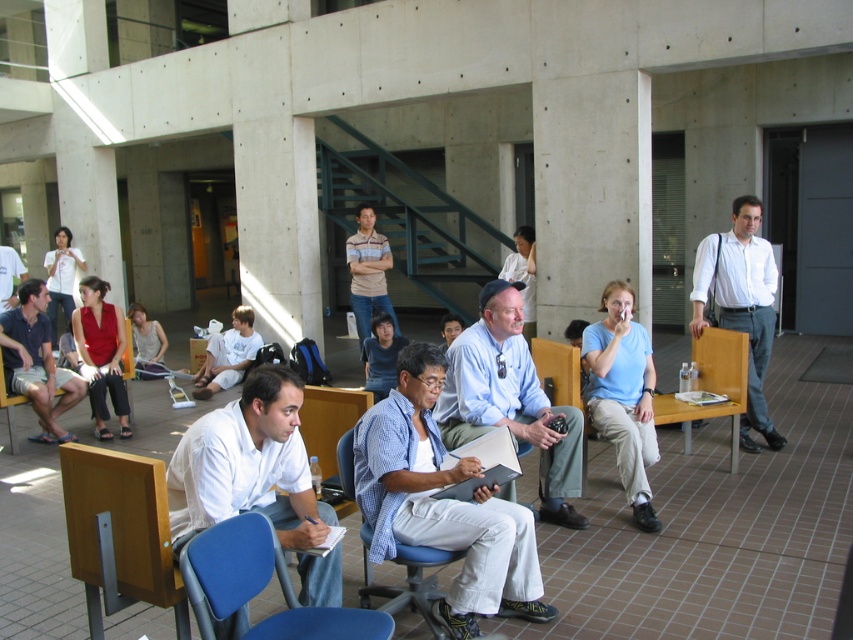
Does white matte shirt at lower left appear on the left side of matte blue shirt at left?

No, white matte shirt at lower left is not to the left of matte blue shirt at left.

Where is `white matte shirt at lower left`? The width and height of the screenshot is (853, 640). white matte shirt at lower left is located at coordinates (248, 465).

Is point (218, 454) positioned in front of point (699, 273)?

Yes, point (218, 454) is closer to viewer.

Is white matte shirt at lower left below white shirt at right?

Yes.

This screenshot has width=853, height=640. Identify the location of white matte shirt at lower left. (248, 465).

In the scene shown: Does light blue shirt at center appear on the left side of blue fabric chair at lower center?

No, light blue shirt at center is not to the left of blue fabric chair at lower center.

Between light blue shirt at center and blue fabric chair at lower center, which one appears on the right side from the viewer's perspective?

light blue shirt at center is more to the right.

At what (x,y) coordinates should I click in order to perform the action: click on light blue shirt at center. Please return your answer as a coordinate pair (x, y). The image size is (853, 640). Looking at the image, I should click on (509, 400).